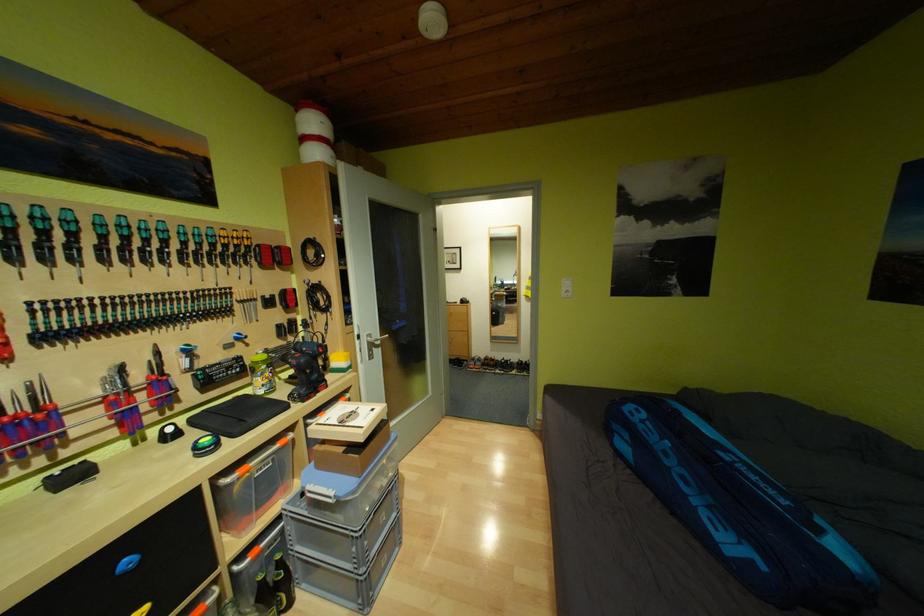
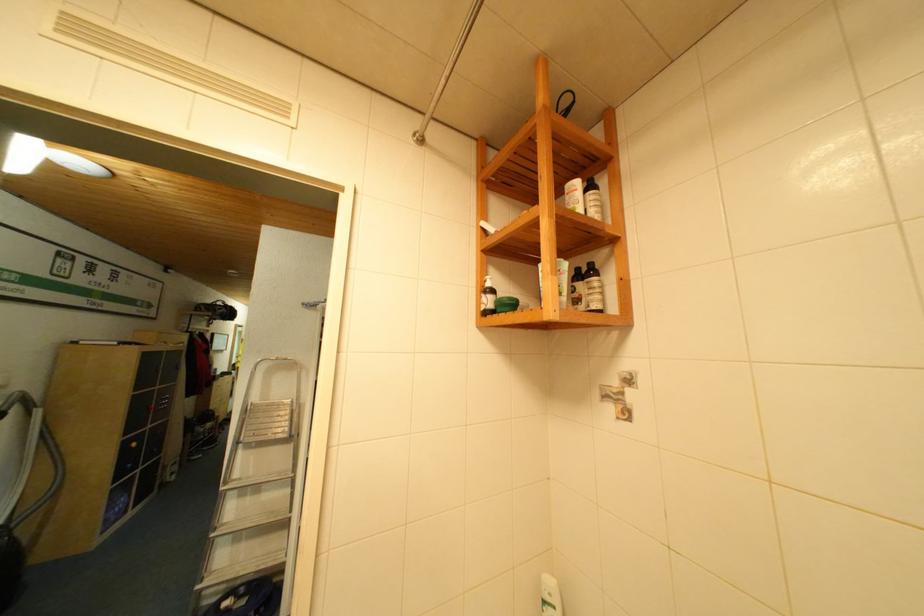
Question: I am providing you with two images of the same scene from different viewpoints. After the viewpoint changes to image2, which objects are now occluded?

Choices:
 (A) white pump bottle
 (B) metal step ladder
 (C) blue and white cup
 (D) blue tennis bag

Answer: (D)